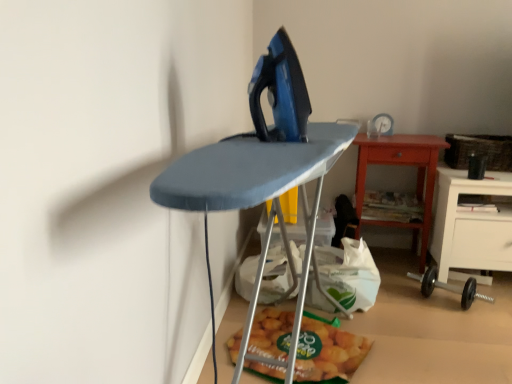
This screenshot has height=384, width=512. Identify the location of vacant space to the right of matte plastic bag of chips at lower center. (422, 344).